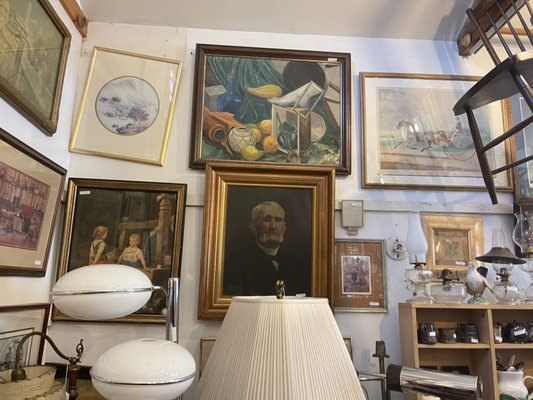
Where is `light wood bookshelf`? light wood bookshelf is located at coordinates (413, 335).